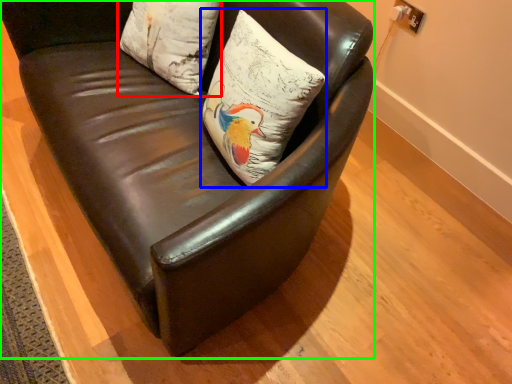
Question: Estimate the real-world distances between objects in this image. Which object is farther from pillow (highlighted by a red box), pillow (highlighted by a blue box) or chair (highlighted by a green box)?

Choices:
 (A) pillow
 (B) chair

Answer: (A)